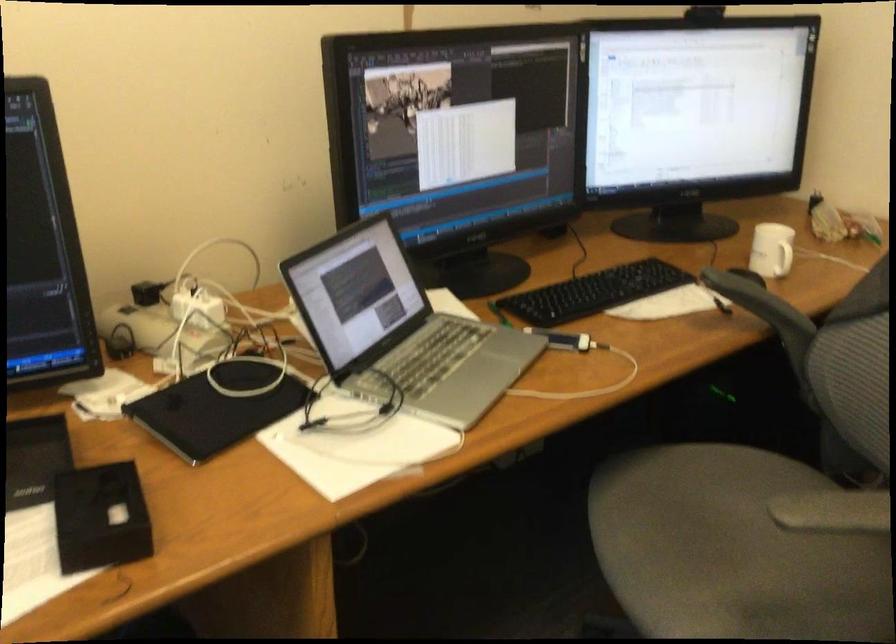
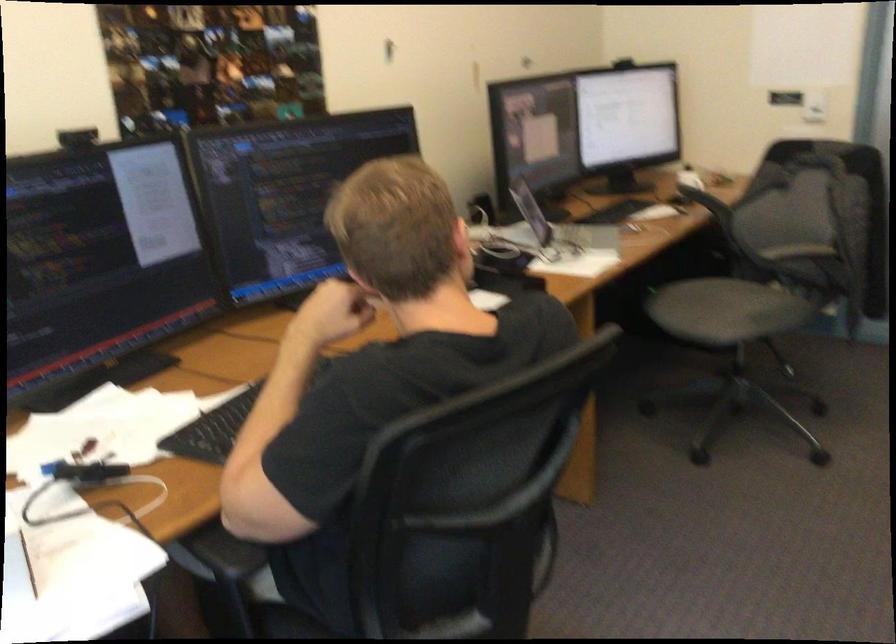
Locate, in the second image, the point that corresponds to (x=426, y=348) in the first image.

(561, 230)